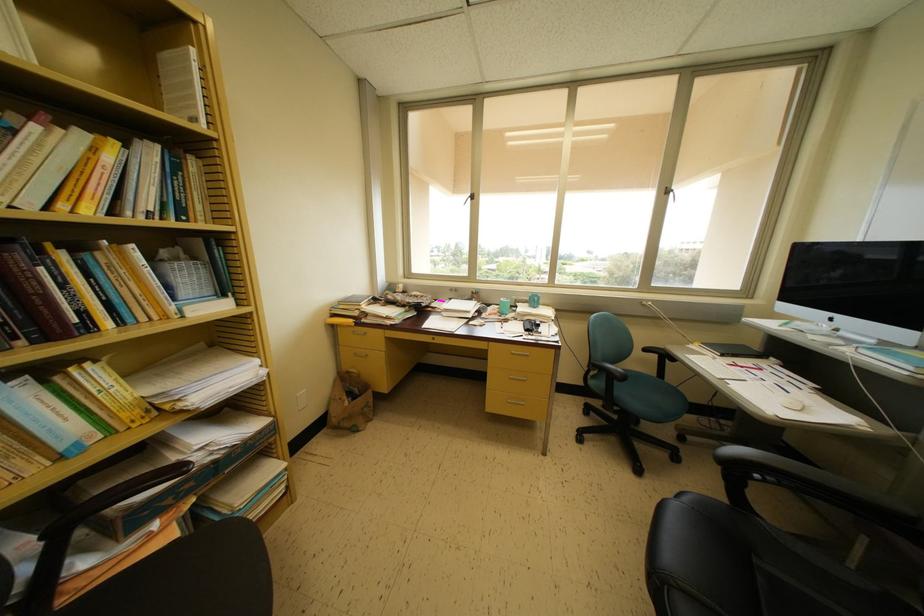
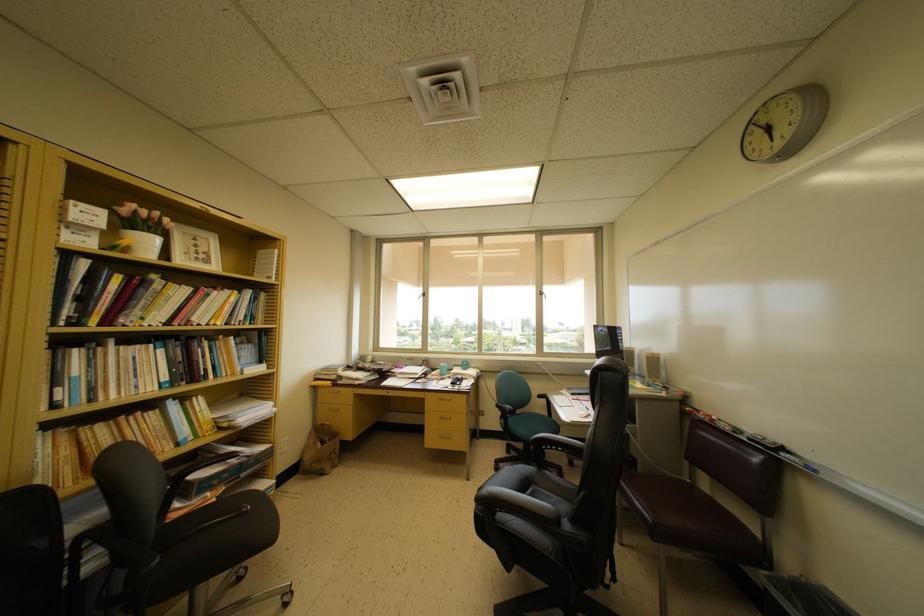
The images are taken continuously from a first-person perspective. In which direction are you moving?

The cameraman walked toward right, backward.